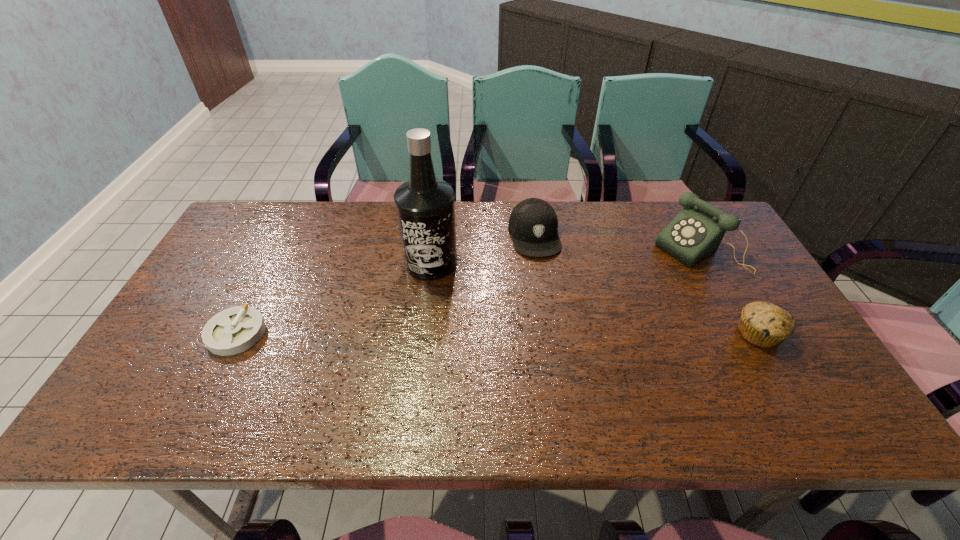
Locate an element on the screen. the leftmost object is located at coordinates (234, 330).

Locate an element on the screen. The width and height of the screenshot is (960, 540). the shortest object is located at coordinates (234, 330).

I want to click on muffin, so click(763, 324).

At what (x,y) coordinates should I click in order to perform the action: click on the third object from left to right. Please return your answer as a coordinate pair (x, y). The image size is (960, 540). Looking at the image, I should click on pos(533,223).

At what (x,y) coordinates should I click in order to perform the action: click on the tallest object. Please return your answer as a coordinate pair (x, y). Looking at the image, I should click on (425, 206).

Where is `liquor`? This screenshot has height=540, width=960. liquor is located at coordinates (425, 206).

The image size is (960, 540). What are the coordinates of `telephone` in the screenshot? It's located at (695, 233).

Where is `free space located 0.370m on the right of the ashtray`? The height and width of the screenshot is (540, 960). free space located 0.370m on the right of the ashtray is located at coordinates (410, 333).

Locate an element on the screen. The height and width of the screenshot is (540, 960). free space located on the left of the muffin is located at coordinates coord(644,334).

The width and height of the screenshot is (960, 540). I want to click on vacant space located 0.190m on the front-facing side of the cap, so click(x=551, y=307).